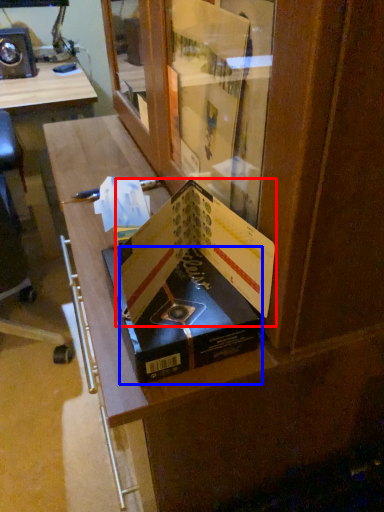
Question: Which of the following is the farthest to the observer, paperback book (highlighted by a red box) or paperback book (highlighted by a blue box)?

Choices:
 (A) paperback book
 (B) paperback book

Answer: (B)